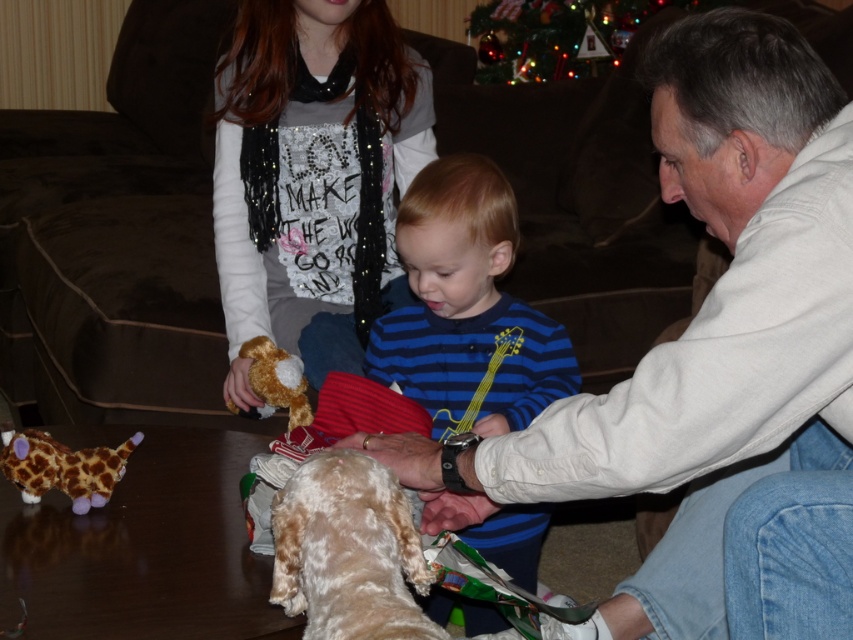
Measure the distance between blue striped shirt at center and plush giraffe at lower left.

A distance of 23.62 inches exists between blue striped shirt at center and plush giraffe at lower left.

Is blue striped shirt at center wider than plush giraffe at lower left?

Yes.

At what (x,y) coordinates should I click in order to perform the action: click on blue striped shirt at center. Please return your answer as a coordinate pair (x, y). Image resolution: width=853 pixels, height=640 pixels. Looking at the image, I should click on (467, 308).

Measure the distance between point (636,417) and camera.

They are 33.98 inches apart.

Does white soft shirt at upper right have a greater height compared to plush giraffe at lower left?

Yes, white soft shirt at upper right is taller than plush giraffe at lower left.

Is point (769, 467) closer to camera compared to point (38, 481)?

No, (769, 467) is further to viewer.

Identify the location of white soft shirt at upper right. pos(717,356).

This screenshot has width=853, height=640. What do you see at coordinates (717, 356) in the screenshot?
I see `white soft shirt at upper right` at bounding box center [717, 356].

Which of these two, white soft shirt at upper right or sparkly sequin shirt at upper center, stands shorter?

sparkly sequin shirt at upper center is shorter.

This screenshot has height=640, width=853. What do you see at coordinates (717, 356) in the screenshot?
I see `white soft shirt at upper right` at bounding box center [717, 356].

Identify the location of white soft shirt at upper right. (717, 356).